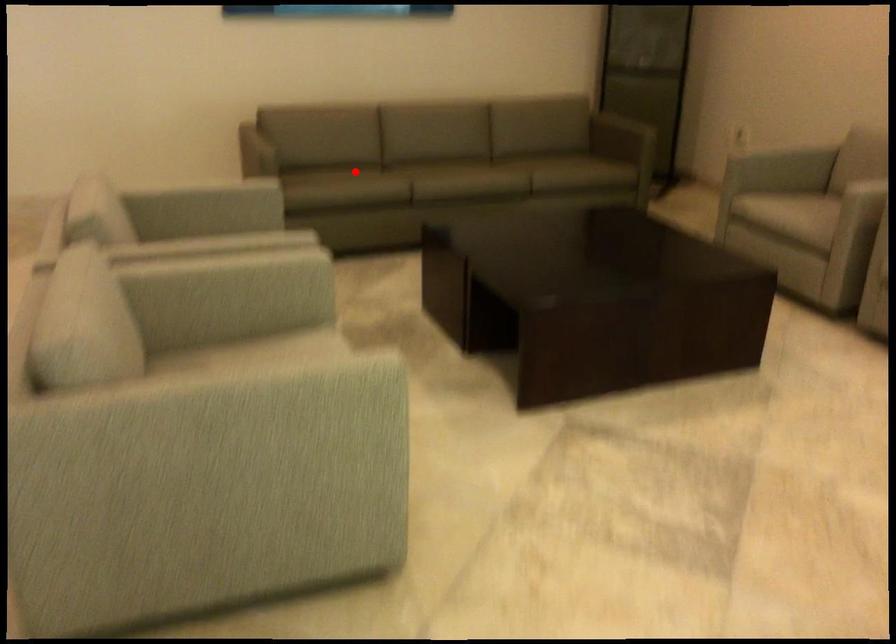
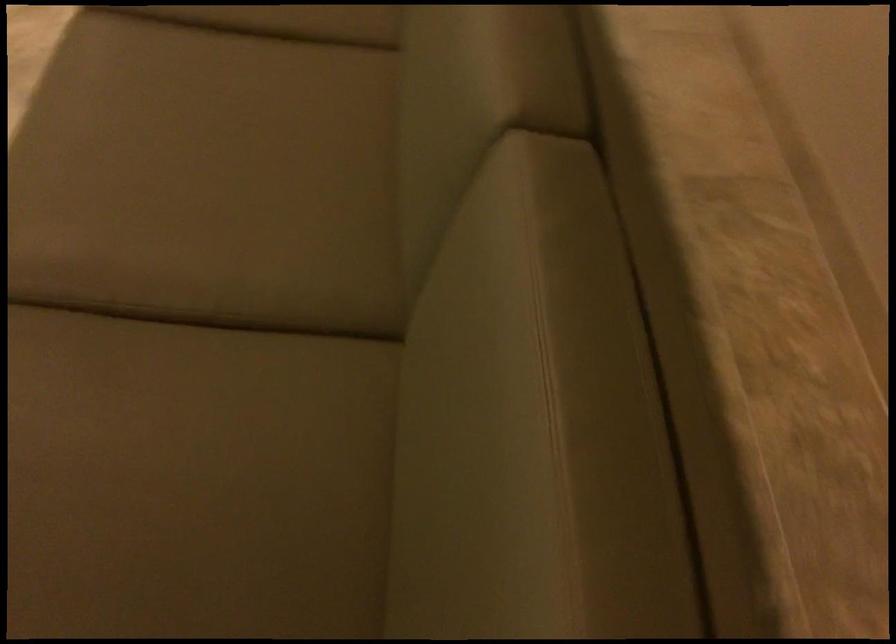
Question: I am providing you with two images of the same scene from different viewpoints. Image1 has a red point marked. In image2, the corresponding 3D location appears at what relative position? Reply with the corresponding letter.

Choices:
 (A) Closer
 (B) Farther

Answer: (A)